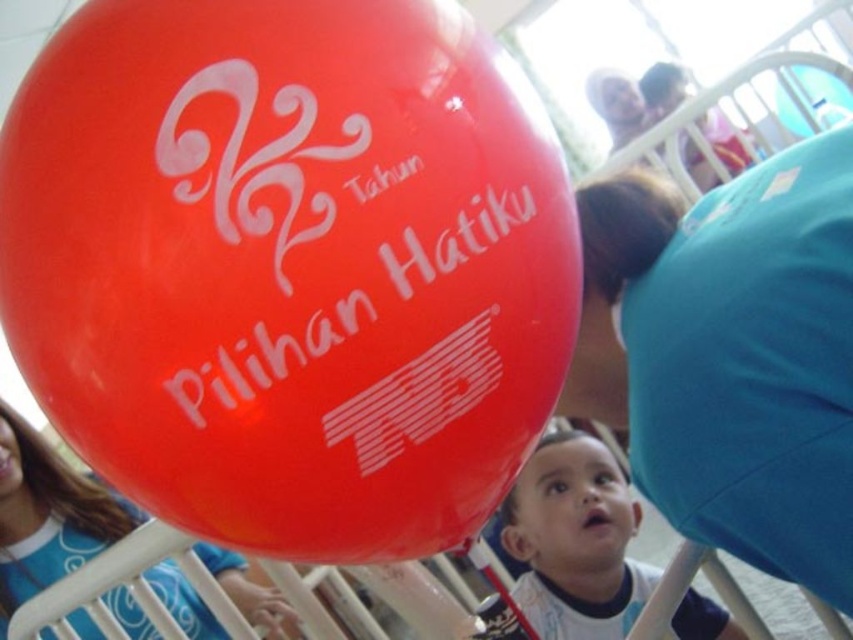
Question: Is glossy rubber balloon at upper left closer to the viewer compared to smooth skin baby at center?

Choices:
 (A) no
 (B) yes

Answer: (B)

Question: Which object is closer to the camera taking this photo?

Choices:
 (A) matte blue shirt at lower left
 (B) smooth skin baby at center
 (C) glossy rubber balloon at upper left

Answer: (C)

Question: Is glossy rubber balloon at upper left positioned at the back of smooth skin baby at center?

Choices:
 (A) yes
 (B) no

Answer: (B)

Question: Among these objects, which one is nearest to the camera?

Choices:
 (A) matte blue shirt at lower left
 (B) smooth skin baby at center
 (C) glossy rubber balloon at upper left

Answer: (C)

Question: Is glossy rubber balloon at upper left closer to camera compared to smooth skin baby at center?

Choices:
 (A) yes
 (B) no

Answer: (A)

Question: Among these points, which one is farthest from the camera?

Choices:
 (A) (189, 592)
 (B) (73, 312)
 (C) (589, 520)

Answer: (A)